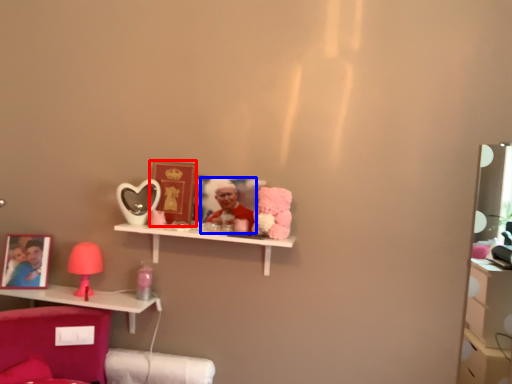
Question: Among these objects, which one is farthest to the camera, picture frame (highlighted by a red box) or person (highlighted by a blue box)?

Choices:
 (A) picture frame
 (B) person

Answer: (A)